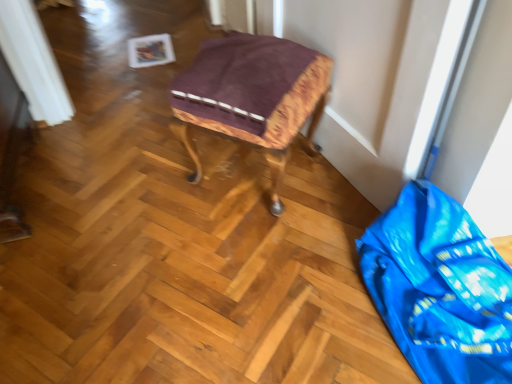
The width and height of the screenshot is (512, 384). Find the location of `blue shiny plastic bag at lower right`. blue shiny plastic bag at lower right is located at coordinates (440, 288).

What do you see at coordinates (440, 288) in the screenshot? I see `blue shiny plastic bag at lower right` at bounding box center [440, 288].

Measure the distance between blue shiny plastic bag at lower right and camera.

The depth of blue shiny plastic bag at lower right is 95.10 centimeters.

Where is `wooden stool at center`? The width and height of the screenshot is (512, 384). wooden stool at center is located at coordinates (252, 97).

What is the approximate width of wooden stool at center?

16.39 inches.

What is the approximate height of wooden stool at center?

The height of wooden stool at center is 18.57 inches.

What do you see at coordinates (252, 97) in the screenshot? The height and width of the screenshot is (384, 512). I see `wooden stool at center` at bounding box center [252, 97].

The height and width of the screenshot is (384, 512). I want to click on blue shiny plastic bag at lower right, so click(440, 288).

Is blue shiny plastic bag at lower right at the left side of wooden stool at center?

No.

Is blue shiny plastic bag at lower right in front of or behind wooden stool at center in the image?

Clearly, blue shiny plastic bag at lower right is in front of wooden stool at center.

Considering the points (479, 340) and (247, 66), which point is behind, point (479, 340) or point (247, 66)?

Positioned behind is point (247, 66).

From the image's perspective, between blue shiny plastic bag at lower right and wooden stool at center, who is located below?

blue shiny plastic bag at lower right.

From a real-world perspective, is blue shiny plastic bag at lower right located beneath wooden stool at center?

Indeed, from a real-world perspective, blue shiny plastic bag at lower right is positioned beneath wooden stool at center.

Looking at their sizes, would you say blue shiny plastic bag at lower right is wider or thinner than wooden stool at center?

blue shiny plastic bag at lower right is wider than wooden stool at center.

Can you confirm if blue shiny plastic bag at lower right is taller than wooden stool at center?

No.

Based on their sizes in the image, would you say blue shiny plastic bag at lower right is bigger or smaller than wooden stool at center?

Clearly, blue shiny plastic bag at lower right is smaller in size than wooden stool at center.

Is blue shiny plastic bag at lower right not inside wooden stool at center?

That's correct, blue shiny plastic bag at lower right is outside of wooden stool at center.

Is blue shiny plastic bag at lower right far from wooden stool at center?

blue shiny plastic bag at lower right is near wooden stool at center, not far away.

Looking at this image, could you tell me if blue shiny plastic bag at lower right is facing wooden stool at center?

No, blue shiny plastic bag at lower right is not turned towards wooden stool at center.

How many degrees apart are the facing directions of blue shiny plastic bag at lower right and wooden stool at center?

38.5 degrees separate the facing orientations of blue shiny plastic bag at lower right and wooden stool at center.

The image size is (512, 384). Identify the location of material directly beneath the wooden stool at center (from a real-world perspective). (440, 288).

Is wooden stool at center to the left or to the right of blue shiny plastic bag at lower right in the image?

Clearly, wooden stool at center is on the left of blue shiny plastic bag at lower right in the image.

Does wooden stool at center lie behind blue shiny plastic bag at lower right?

Yes, wooden stool at center is further from the camera.

Which is closer, [199,93] or [481,303]?

Point [199,93] appears to be farther away from the viewer than point [481,303].

Looking at this image, from the image's perspective, is wooden stool at center above or below blue shiny plastic bag at lower right?

Clearly, from the image's perspective, wooden stool at center is above blue shiny plastic bag at lower right.

From a real-world perspective, between wooden stool at center and blue shiny plastic bag at lower right, who is vertically higher?

wooden stool at center, from a real-world perspective.

Looking at their sizes, would you say wooden stool at center is wider or thinner than blue shiny plastic bag at lower right?

Clearly, wooden stool at center has less width compared to blue shiny plastic bag at lower right.

Which of these two, wooden stool at center or blue shiny plastic bag at lower right, stands shorter?

With less height is blue shiny plastic bag at lower right.

Can you confirm if wooden stool at center is smaller than blue shiny plastic bag at lower right?

Actually, wooden stool at center might be larger than blue shiny plastic bag at lower right.

From the picture: Is blue shiny plastic bag at lower right a part of wooden stool at center?

That's incorrect, blue shiny plastic bag at lower right is not inside wooden stool at center.

Is wooden stool at center placed right next to blue shiny plastic bag at lower right?

They are not placed beside each other.

Is wooden stool at center oriented away from blue shiny plastic bag at lower right?

No, wooden stool at center's orientation is not away from blue shiny plastic bag at lower right.

How far apart are wooden stool at center and blue shiny plastic bag at lower right?

wooden stool at center is 19.53 inches from blue shiny plastic bag at lower right.

Image resolution: width=512 pixels, height=384 pixels. I want to click on furniture behind the blue shiny plastic bag at lower right, so click(252, 97).

You are a GUI agent. You are given a task and a screenshot of the screen. Output one action in this format:
    pyautogui.click(x=<x>, y=<y>)
    Task: Click on the furniture on the left of the blue shiny plastic bag at lower right
    The width and height of the screenshot is (512, 384).
    Given the screenshot: What is the action you would take?
    pyautogui.click(x=252, y=97)

The height and width of the screenshot is (384, 512). I want to click on furniture located behind the blue shiny plastic bag at lower right, so click(252, 97).